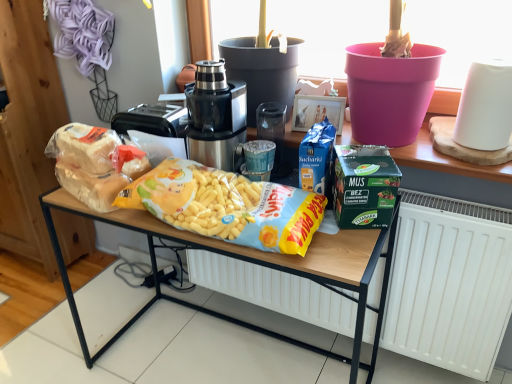
Locate an element on the screen. Image resolution: width=512 pixels, height=384 pixels. vacant space in front of green matte lunch box at center is located at coordinates (341, 254).